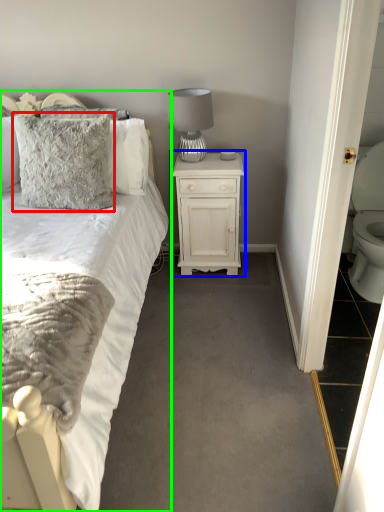
Question: Considering the real-world distances, which object is closest to pillow (highlighted by a red box)? nightstand (highlighted by a blue box) or bed (highlighted by a green box).

Choices:
 (A) nightstand
 (B) bed

Answer: (B)